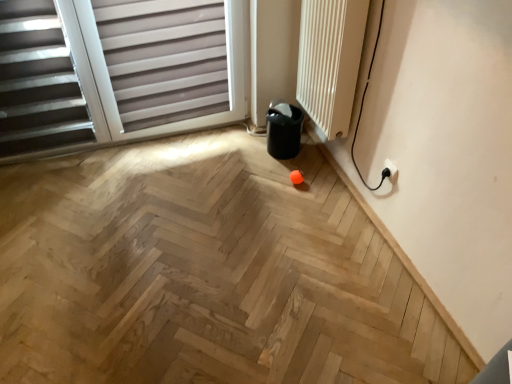
The width and height of the screenshot is (512, 384). In order to click on empty space that is ontop of natural wood floor at center (from a real-world perspective) in this screenshot , I will do `click(152, 297)`.